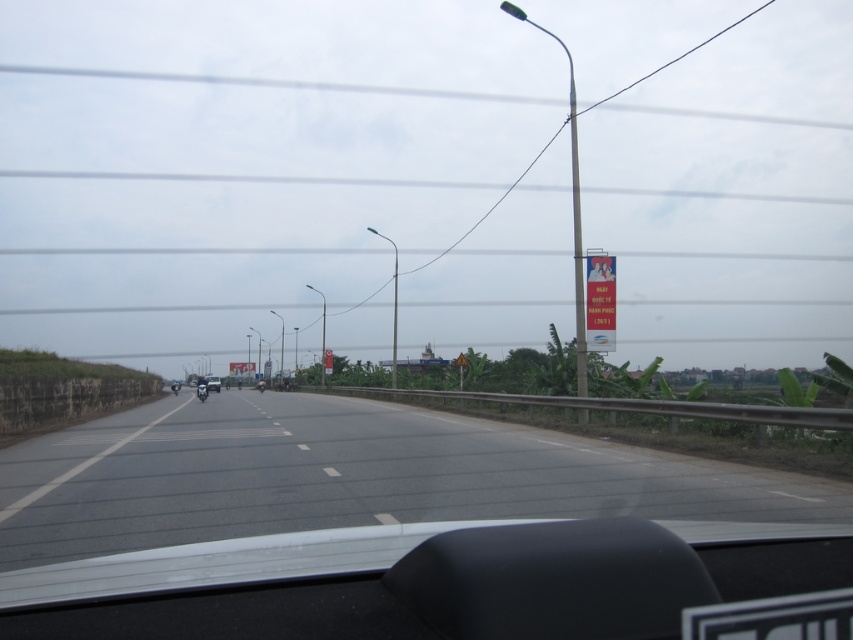
Who is positioned more to the right, metallic pole at right or black glossy motorcycle at center?

Positioned to the right is metallic pole at right.

Is metallic pole at right shorter than black glossy motorcycle at center?

In fact, metallic pole at right may be taller than black glossy motorcycle at center.

Describe the element at coordinates (577, 244) in the screenshot. The width and height of the screenshot is (853, 640). I see `metallic pole at right` at that location.

The height and width of the screenshot is (640, 853). Find the location of `metallic pole at right`. metallic pole at right is located at coordinates (577, 244).

What do you see at coordinates (577, 244) in the screenshot? The width and height of the screenshot is (853, 640). I see `metallic pole at right` at bounding box center [577, 244].

Is metallic pole at right bigger than metallic silver motorcycle at center?

Yes.

Is point (576, 182) positioned in front of point (260, 378)?

No.

You are a GUI agent. You are given a task and a screenshot of the screen. Output one action in this format:
    pyautogui.click(x=<x>, y=<y>)
    Task: Click on the metallic pole at right
    
    Given the screenshot: What is the action you would take?
    pyautogui.click(x=577, y=244)

Is red plastic sign at right wider than shiny black motorcycle at center?

In fact, red plastic sign at right might be narrower than shiny black motorcycle at center.

Which is in front, point (595, 337) or point (206, 388)?

Point (595, 337)

This screenshot has height=640, width=853. Find the location of `red plastic sign at right`. red plastic sign at right is located at coordinates (601, 301).